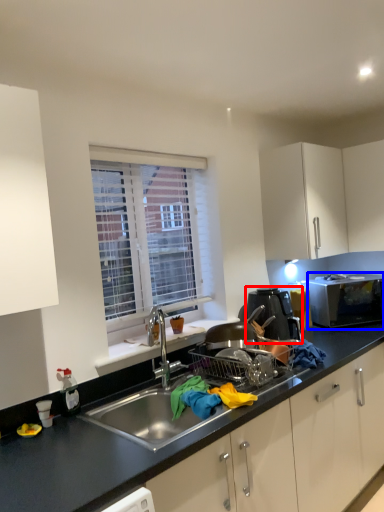
Question: Which point is further to the camera, home appliance (highlighted by a red box) or microwave oven (highlighted by a blue box)?

Choices:
 (A) home appliance
 (B) microwave oven

Answer: (B)